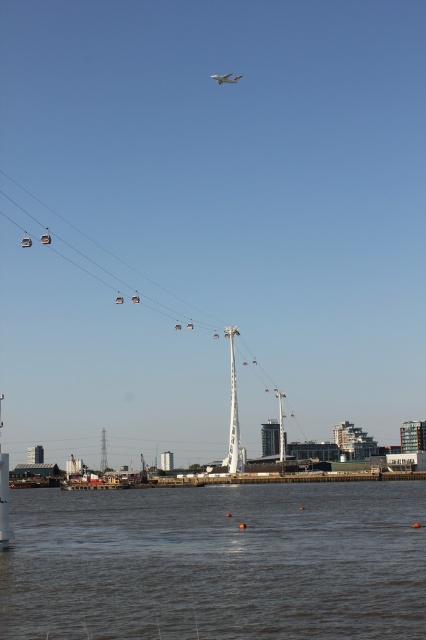
Is metallic cable car at center thinner than brown water at lower center?

In fact, metallic cable car at center might be wider than brown water at lower center.

Describe the element at coordinates (157, 308) in the screenshot. Image resolution: width=426 pixels, height=640 pixels. I see `metallic cable car at center` at that location.

Image resolution: width=426 pixels, height=640 pixels. I want to click on metallic cable car at center, so click(157, 308).

Between brown water at lower center and white matte airplane at upper center, which one appears on the left side from the viewer's perspective?

white matte airplane at upper center is more to the left.

Identify the location of brown water at lower center. (216, 563).

Does point (187, 339) lie behind point (224, 80)?

That is False.

Is metallic cable car at center positioned at the back of white matte airplane at upper center?

No, metallic cable car at center is in front of white matte airplane at upper center.

The height and width of the screenshot is (640, 426). Find the location of `metallic cable car at center`. metallic cable car at center is located at coordinates (157, 308).